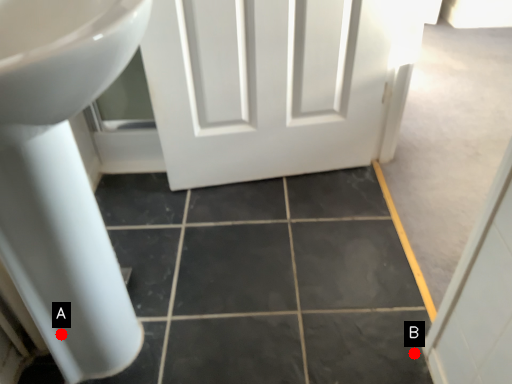
Question: Two points are circled on the image, labeled by A and B beside each circle. Which point is further to the camera?

Choices:
 (A) A is further
 (B) B is further

Answer: (B)